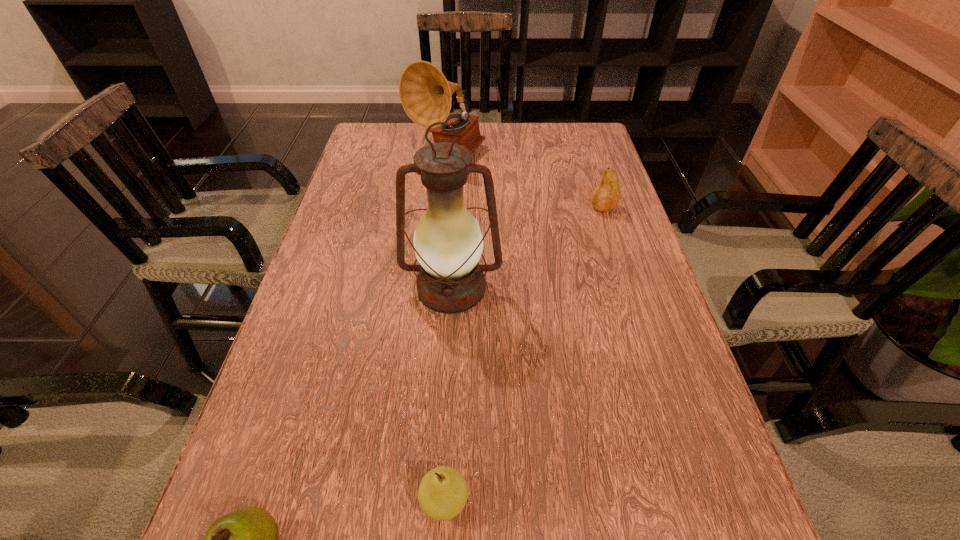
At what (x,y) coordinates should I click in order to perform the action: click on free space between the rightmost object and the third nearest object. Please return your answer as a coordinate pair (x, y). This screenshot has height=540, width=960. Looking at the image, I should click on (527, 248).

The height and width of the screenshot is (540, 960). Identify the location of free space between the rightmost object and the oil lamp. (527, 248).

In order to click on free spot between the shortest object and the phonograph record in this screenshot , I will do `click(445, 327)`.

The width and height of the screenshot is (960, 540). What are the coordinates of `free space between the rightmost pear and the second pear from left to right` in the screenshot? It's located at (523, 354).

Identify the location of free area in between the shortest object and the tallest object. (448, 395).

The width and height of the screenshot is (960, 540). I want to click on vacant point located between the rightmost pear and the fourth shortest object, so click(x=525, y=181).

Locate an element on the screen. object that is the second nearest to the shortest object is located at coordinates (448, 243).

Where is `object that is the fourth closest to the oil lamp`? The height and width of the screenshot is (540, 960). object that is the fourth closest to the oil lamp is located at coordinates (247, 539).

Identify which pear is the third nearest to the phonograph record. Please provide its 2D coordinates. Your answer should be formatted as a tuple, i.e. [(x, y)], where the tuple contains the x and y coordinates of a point satisfying the conditions above.

[(247, 539)]

Identify the location of pear that is the second closest one to the oil lamp. This screenshot has width=960, height=540. (443, 492).